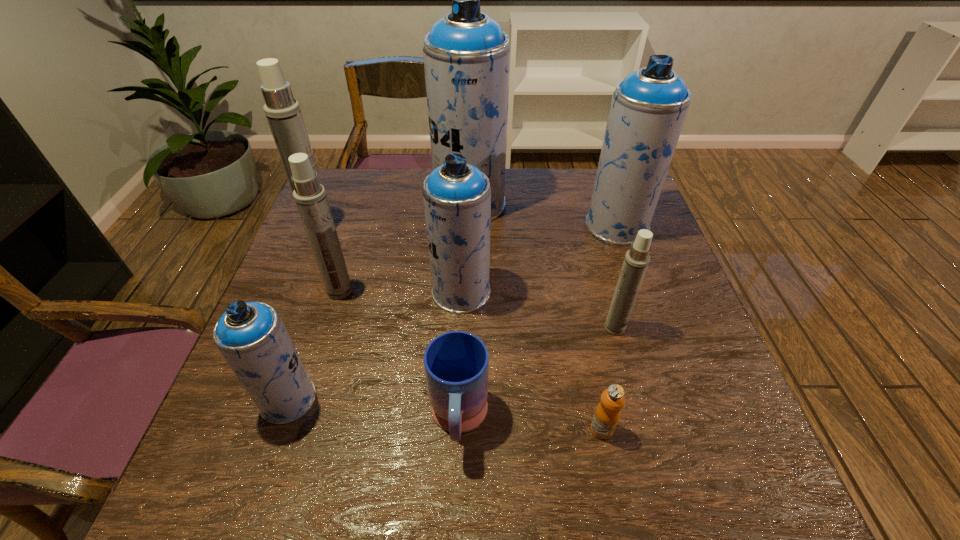
At what (x,y) coordinates should I click in order to perform the action: click on the nearest aerosol can. Please return your answer as a coordinate pair (x, y). The height and width of the screenshot is (540, 960). Looking at the image, I should click on (251, 336).

Where is `the smallest blue aerosol can`? The image size is (960, 540). the smallest blue aerosol can is located at coordinates (251, 336).

Where is `mug`? The width and height of the screenshot is (960, 540). mug is located at coordinates tap(456, 363).

In order to click on orange juice in this screenshot , I will do `click(607, 414)`.

The width and height of the screenshot is (960, 540). In order to click on the third object from right to left in this screenshot , I will do `click(607, 414)`.

Image resolution: width=960 pixels, height=540 pixels. I want to click on free space located on the left of the tallest aerosol can, so click(x=381, y=204).

Image resolution: width=960 pixels, height=540 pixels. Identify the location of vacant space situated 0.150m on the right of the farthest white aerosol can. (388, 231).

Where is `free space located on the front of the third smallest blue aerosol can`? This screenshot has height=540, width=960. free space located on the front of the third smallest blue aerosol can is located at coordinates (642, 299).

At what (x,y) coordinates should I click in order to perform the action: click on free point located on the right of the second farthest white aerosol can. Please return your answer as a coordinate pair (x, y). Looking at the image, I should click on (427, 291).

Find the location of `free space located 0.280m on the left of the second nearest blue aerosol can`. free space located 0.280m on the left of the second nearest blue aerosol can is located at coordinates (315, 292).